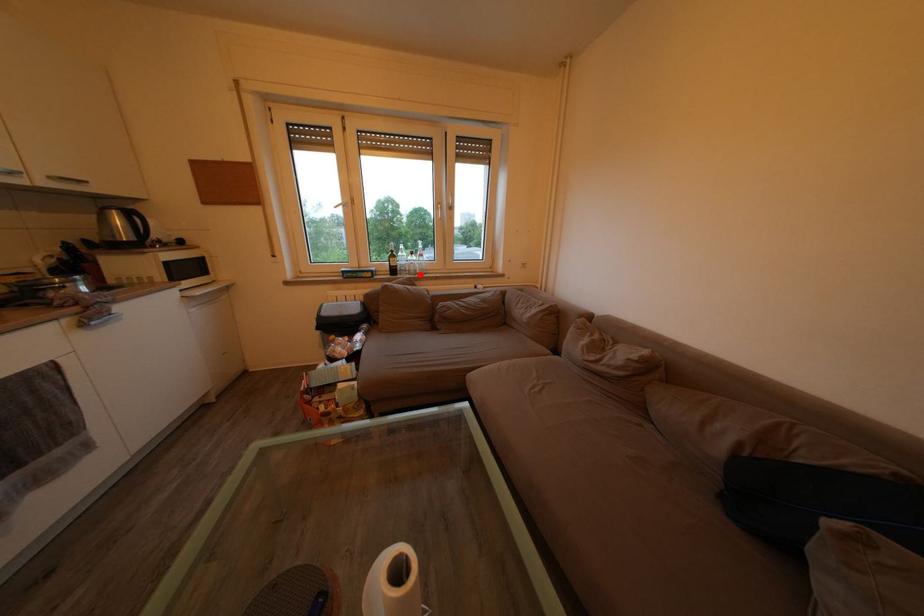
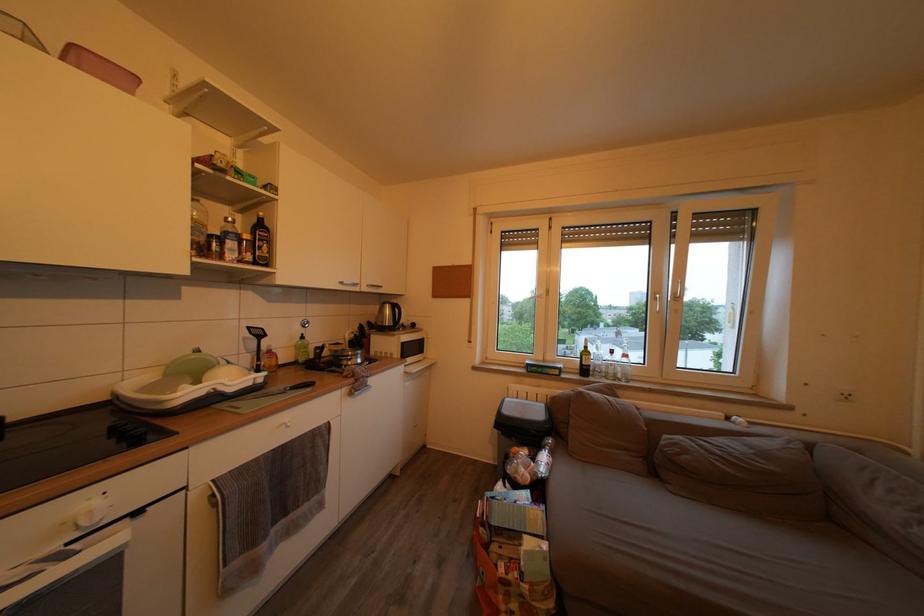
Question: I am providing you with two images of the same scene from different viewpoints. Given a red point in image1, look at the same physical point in image2. Is it:

Choices:
 (A) Closer to the viewpoint
 (B) Farther from the viewpoint

Answer: (B)